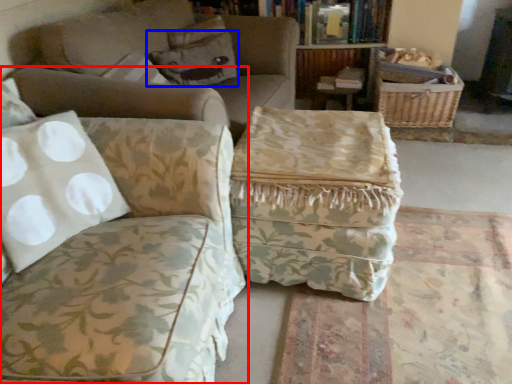
Question: Which object is further to the camera taking this photo, studio couch (highlighted by a red box) or pillow (highlighted by a blue box)?

Choices:
 (A) studio couch
 (B) pillow

Answer: (B)